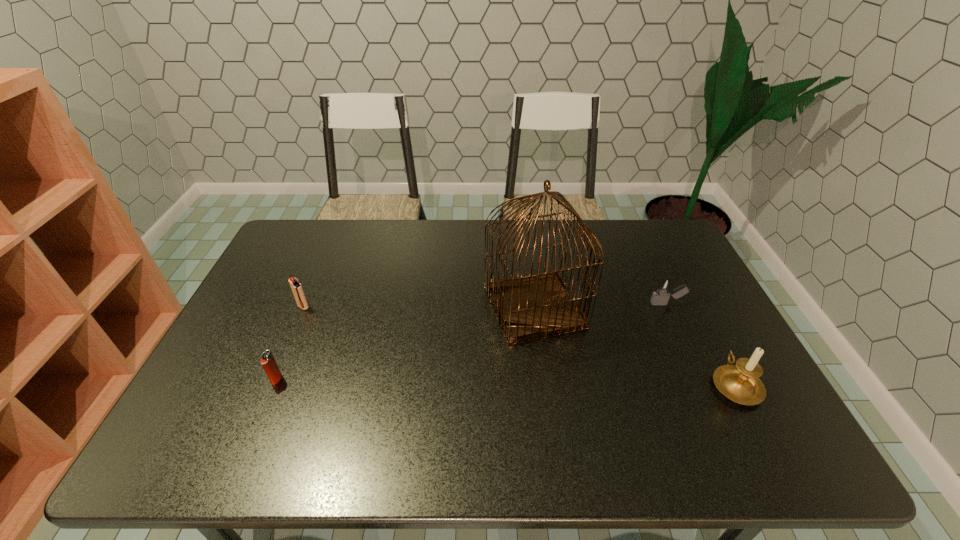
This screenshot has height=540, width=960. I want to click on birdcage, so click(x=535, y=306).

Find the location of a particular element. This screenshot has width=960, height=540. the third object from left to right is located at coordinates (535, 306).

The width and height of the screenshot is (960, 540). I want to click on the fourth shortest object, so click(740, 383).

The height and width of the screenshot is (540, 960). I want to click on the rightmost igniter, so click(x=664, y=286).

This screenshot has height=540, width=960. I want to click on the nearest igniter, so click(268, 362).

At what (x,y) coordinates should I click in order to perform the action: click on blank area located 0.250m on the back of the birdcage. Please return your answer as a coordinate pair (x, y). The image size is (960, 540). Looking at the image, I should click on (524, 231).

Find the location of `free space located with a handle on the side of the candle holder`. free space located with a handle on the side of the candle holder is located at coordinates (688, 294).

At what (x,y) coordinates should I click in order to perform the action: click on free spot located 0.160m with a handle on the side of the candle holder. Please return your answer as a coordinate pair (x, y). Looking at the image, I should click on (701, 318).

Find the location of `free spot located 0.060m with a handle on the side of the candle holder`. free spot located 0.060m with a handle on the side of the candle holder is located at coordinates (714, 344).

Locate an element on the screen. This screenshot has height=540, width=960. vacant region located 0.140m on the left of the rightmost igniter is located at coordinates (604, 304).